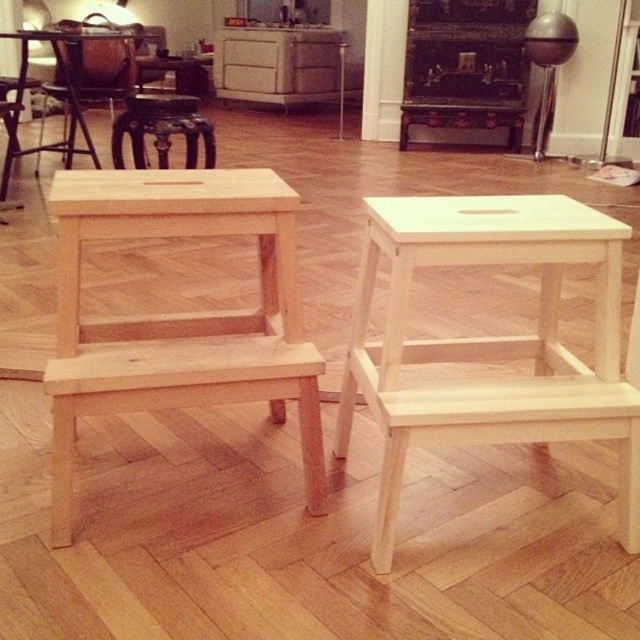
Who is higher up, wooden stool at left or wooden table at center?

Positioned higher is wooden table at center.

In order to click on wooden stool at left in this screenshot , I will do `click(65, 99)`.

Measure the distance between point (x=68, y=81) and camera.

Point (x=68, y=81) is 3.71 meters from camera.

This screenshot has width=640, height=640. Find the location of `wooden stool at left`. wooden stool at left is located at coordinates (65, 99).

Who is higher up, natural wood step stool at center or natural wood step stool at left?

natural wood step stool at left is above.

Does point (420, 259) come closer to viewer compared to point (156, 205)?

Yes, it is in front of point (156, 205).

Where is `natural wood step stool at center`? natural wood step stool at center is located at coordinates (490, 340).

The height and width of the screenshot is (640, 640). I want to click on natural wood step stool at center, so click(x=490, y=340).

Does natural wood step stool at left have a lesser width compared to wooden stool at left?

Correct, natural wood step stool at left's width is less than wooden stool at left's.

Who is more distant from viewer, (276, 273) or (19, 96)?

The point (19, 96) is more distant.

At what (x,y) coordinates should I click in order to perform the action: click on natural wood step stool at left. Please return your answer as a coordinate pair (x, y). This screenshot has width=640, height=640. Looking at the image, I should click on (179, 314).